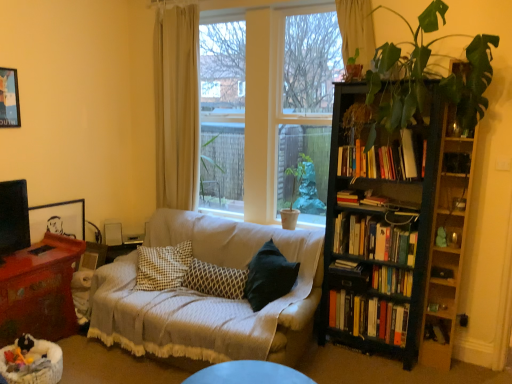
Question: Is hardcover books at right, marked as the 2th book in a bottom-to-top arrangement, spatially inside brushed metal picture frame at upper left, acting as the second picture frame starting from the bottom, or outside of it?

Choices:
 (A) inside
 (B) outside

Answer: (B)

Question: Is hardcover books at right, which ranks as the 5th book in top-to-bottom order, in front of or behind brushed metal picture frame at upper left, acting as the second picture frame starting from the bottom, in the image?

Choices:
 (A) behind
 (B) front

Answer: (B)

Question: Estimate the real-world distances between objects in this image. Which object is farther from the beige fabric curtain at upper left, which is counted as the 2th curtain, starting from the front?

Choices:
 (A) hardcover books at right, which is the sixth book from top to bottom
 (B) wooden picture frame at left, the first picture frame viewed from the right
 (C) hardcover books at right, placed as the 3th book when sorted from top to bottom
 (D) black wooden bookcase at right
 (E) brushed metal picture frame at upper left, positioned as the first picture frame in top-to-bottom order

Answer: (A)

Question: Which is farther from the green matte plant at center?

Choices:
 (A) clear glass window at center
 (B) patterned fabric pillow at center
 (C) mahogany wood table at lower left
 (D) brushed metal picture frame at upper left, acting as the second picture frame starting from the bottom
 (E) black wooden bookcase at right

Answer: (D)